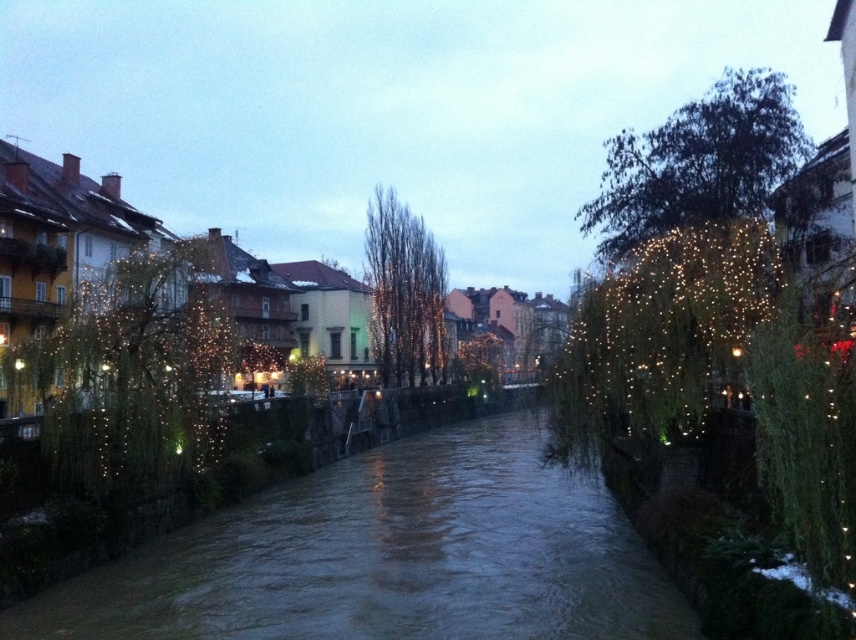
Question: Is brown water at center positioned in front of illuminated wire at left?

Choices:
 (A) no
 (B) yes

Answer: (B)

Question: Does illuminated wire at left lie in front of illuminated willow tree at center-right?

Choices:
 (A) no
 (B) yes

Answer: (A)

Question: Which point is farther from the camera taking this photo?

Choices:
 (A) (519, 609)
 (B) (623, 150)

Answer: (B)

Question: Which object appears farthest from the camera in this image?

Choices:
 (A) brown water at center
 (B) illuminated willow tree at center-right
 (C) illuminated wire at left
 (D) illuminated string lights at center

Answer: (D)

Question: Can you confirm if illuminated wire at left is positioned to the left of green leafy tree at center?

Choices:
 (A) yes
 (B) no

Answer: (A)

Question: Which object appears closest to the camera in this image?

Choices:
 (A) green leafy tree at upper right
 (B) green leafy tree at center
 (C) brown water at center
 (D) illuminated willow tree at center-right

Answer: (C)